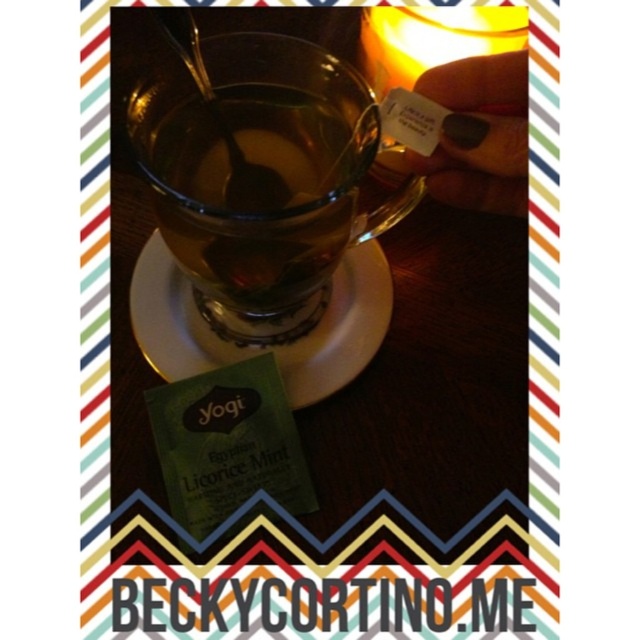
Who is shorter, transparent glass teacup at center or green paper packet at lower left?

green paper packet at lower left

Is transparent glass teacup at center positioned at the back of green paper packet at lower left?

No.

Does point (323, 250) lie in front of point (376, 333)?

Yes, point (323, 250) is closer to viewer.

Locate an element on the screen. Image resolution: width=640 pixels, height=640 pixels. transparent glass teacup at center is located at coordinates (260, 177).